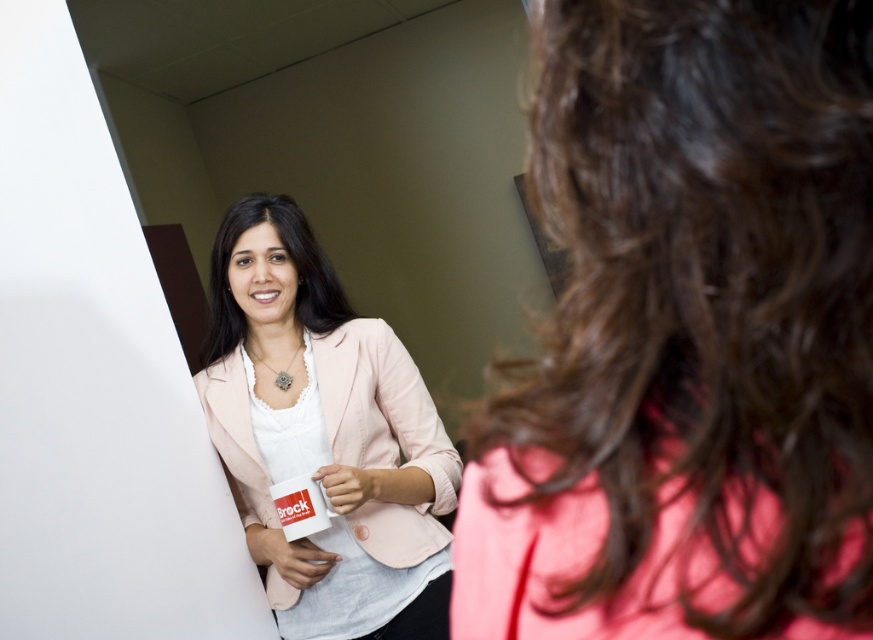
Which is more to the left, matte pink blazer at upper left or matte pink blazer at center?

matte pink blazer at center is more to the left.

Does point (751, 262) lie in front of point (327, 436)?

Yes, it is in front of point (327, 436).

Is point (565, 330) farther from viewer compared to point (246, 538)?

That is False.

At what (x,y) coordinates should I click in order to perform the action: click on matte pink blazer at upper left. Please return your answer as a coordinate pair (x, y). The width and height of the screenshot is (873, 640). Looking at the image, I should click on (688, 336).